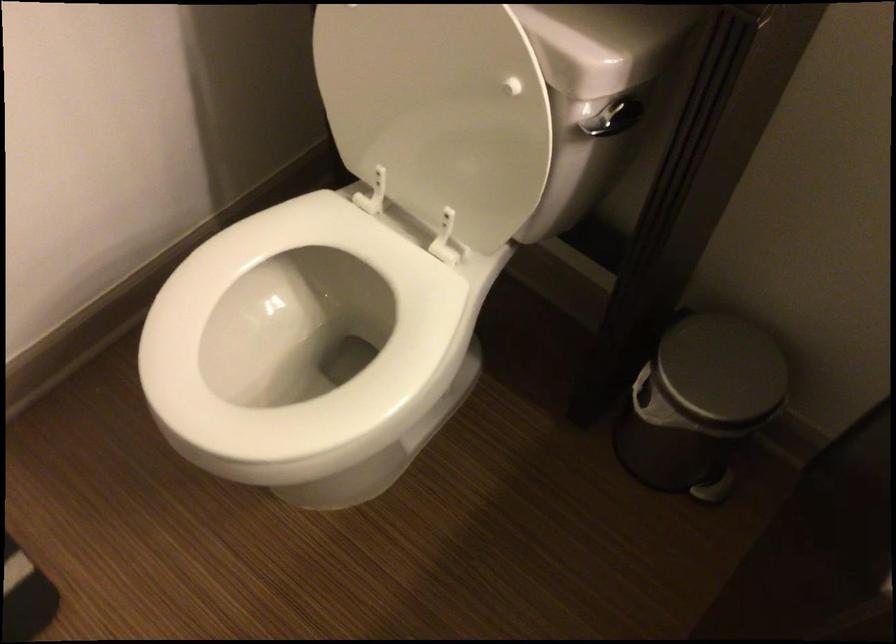
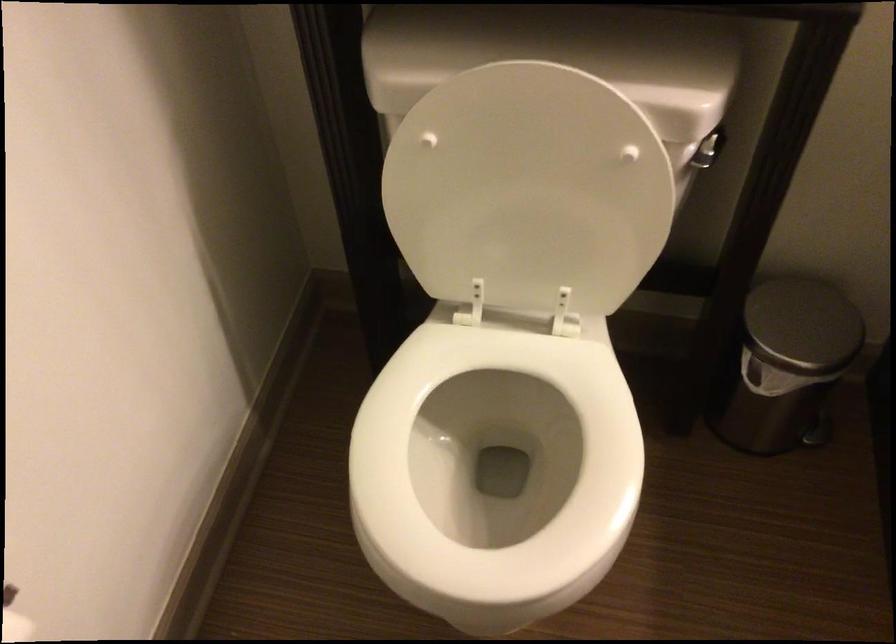
Where in the second image is the point corresponding to (710,366) from the first image?

(803, 325)